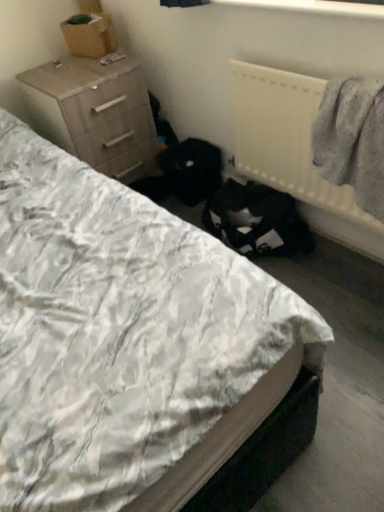
Question: Considering the relative sizes of white plastic radiator at upper right and light brown wood chest of drawers at upper left in the image provided, is white plastic radiator at upper right wider than light brown wood chest of drawers at upper left?

Choices:
 (A) yes
 (B) no

Answer: (B)

Question: Is there a large distance between white plastic radiator at upper right and light brown wood chest of drawers at upper left?

Choices:
 (A) yes
 (B) no

Answer: (B)

Question: Can you confirm if white plastic radiator at upper right is positioned to the left of light brown wood chest of drawers at upper left?

Choices:
 (A) yes
 (B) no

Answer: (B)

Question: Is white plastic radiator at upper right aimed at light brown wood chest of drawers at upper left?

Choices:
 (A) no
 (B) yes

Answer: (A)

Question: From the image's perspective, does white plastic radiator at upper right appear lower than light brown wood chest of drawers at upper left?

Choices:
 (A) no
 (B) yes

Answer: (B)

Question: Relative to white quilted bed at center, is white plastic radiator at upper right in front or behind?

Choices:
 (A) front
 (B) behind

Answer: (B)

Question: In the image, is white plastic radiator at upper right on the left side or the right side of white quilted bed at center?

Choices:
 (A) left
 (B) right

Answer: (B)

Question: Considering the positions of white plastic radiator at upper right and white quilted bed at center in the image, is white plastic radiator at upper right taller or shorter than white quilted bed at center?

Choices:
 (A) short
 (B) tall

Answer: (A)

Question: From a real-world perspective, relative to white quilted bed at center, is white plastic radiator at upper right vertically above or below?

Choices:
 (A) below
 (B) above

Answer: (B)

Question: From their relative heights in the image, would you say gray woolen sweater at right is taller or shorter than white quilted bed at center?

Choices:
 (A) tall
 (B) short

Answer: (B)

Question: Looking at their shapes, would you say gray woolen sweater at right is wider or thinner than white quilted bed at center?

Choices:
 (A) thin
 (B) wide

Answer: (A)

Question: Considering the positions of point (367, 87) and point (249, 264), is point (367, 87) closer or farther from the camera than point (249, 264)?

Choices:
 (A) closer
 (B) farther

Answer: (B)

Question: Would you say gray woolen sweater at right is to the left or to the right of white quilted bed at center in the picture?

Choices:
 (A) right
 (B) left

Answer: (A)

Question: Is light brown wood chest of drawers at upper left inside the boundaries of white plastic radiator at upper right, or outside?

Choices:
 (A) inside
 (B) outside

Answer: (B)

Question: Is light brown wood chest of drawers at upper left taller or shorter than white plastic radiator at upper right?

Choices:
 (A) tall
 (B) short

Answer: (A)